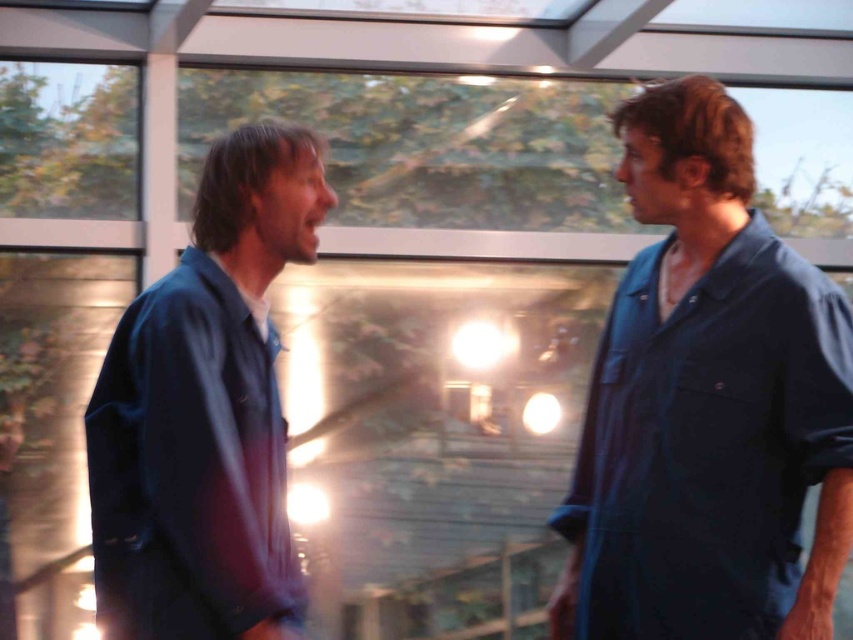
Is dark blue shirt at right thinner than blue cotton shirt at left?

Incorrect, dark blue shirt at right's width is not less than blue cotton shirt at left's.

Between dark blue shirt at right and blue cotton shirt at left, which one has more height?

dark blue shirt at right is taller.

Does point (746, 284) come closer to viewer compared to point (106, 522)?

No, (746, 284) is further to viewer.

The width and height of the screenshot is (853, 640). I want to click on dark blue shirt at right, so click(706, 404).